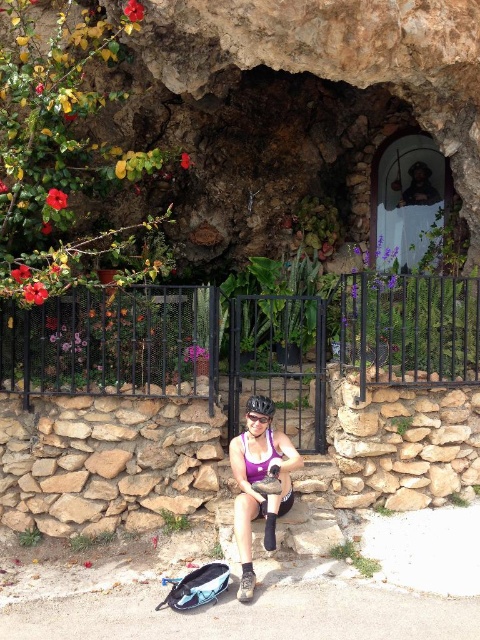
Which is behind, point (256, 404) or point (261, 417)?

The point (256, 404) is more distant.

Which is more to the left, black matte bicycle helmet at center or transparent plastic goggles at center?

From the viewer's perspective, transparent plastic goggles at center appears more on the left side.

Where is `black matte bicycle helmet at center`? The width and height of the screenshot is (480, 640). black matte bicycle helmet at center is located at coordinates (260, 404).

Describe the element at coordinates (244, 342) in the screenshot. I see `black metal fence at center` at that location.

Which is more to the left, black metal fence at center or matte purple tank top at center?

Positioned to the left is matte purple tank top at center.

What do you see at coordinates (244, 342) in the screenshot? I see `black metal fence at center` at bounding box center [244, 342].

The image size is (480, 640). Identify the location of black metal fence at center. (244, 342).

Who is more forward, (407, 321) or (259, 416)?

Point (259, 416) is in front.

Is black metal fence at center thinner than transparent plastic goggles at center?

In fact, black metal fence at center might be wider than transparent plastic goggles at center.

Is point (352, 353) positioned behind point (245, 417)?

No, it is in front of (245, 417).

At what (x,y) coordinates should I click in order to perform the action: click on black metal fence at center. Please return your answer as a coordinate pair (x, y). The height and width of the screenshot is (640, 480). Looking at the image, I should click on (244, 342).